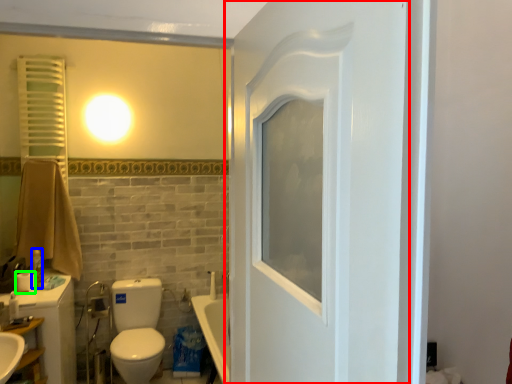
Question: Estimate the real-world distances between objects in this image. Which object is closer to door (highlighted by a red box), toiletry (highlighted by a blue box) or toilet paper (highlighted by a green box)?

Choices:
 (A) toiletry
 (B) toilet paper

Answer: (B)